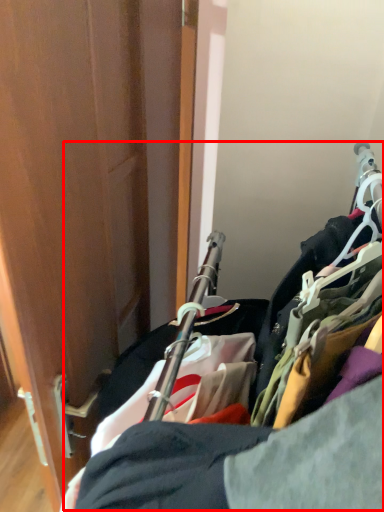
Question: Considering the relative positions of closet (annotated by the red box) and door in the image provided, where is closet (annotated by the red box) located with respect to the staircase?

Choices:
 (A) left
 (B) right

Answer: (B)